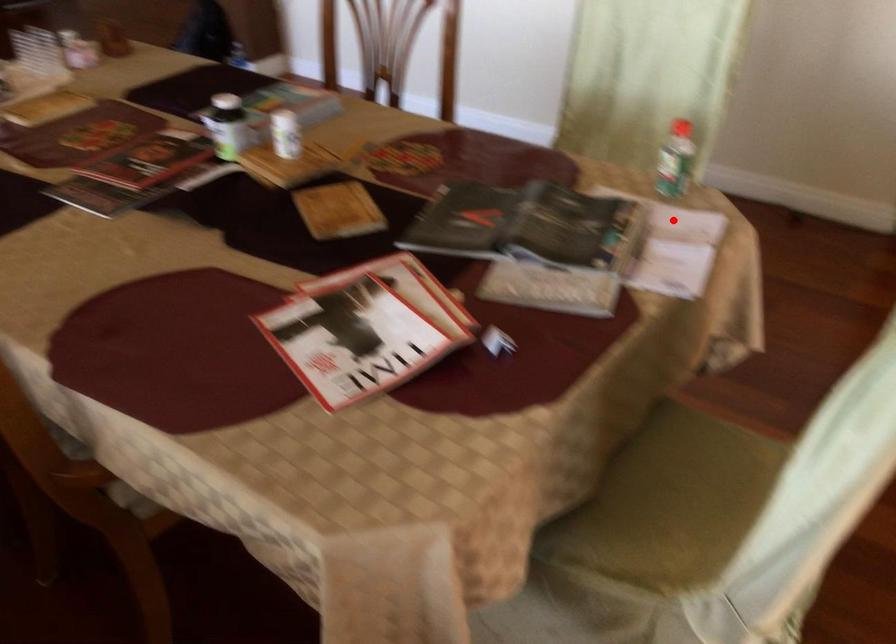
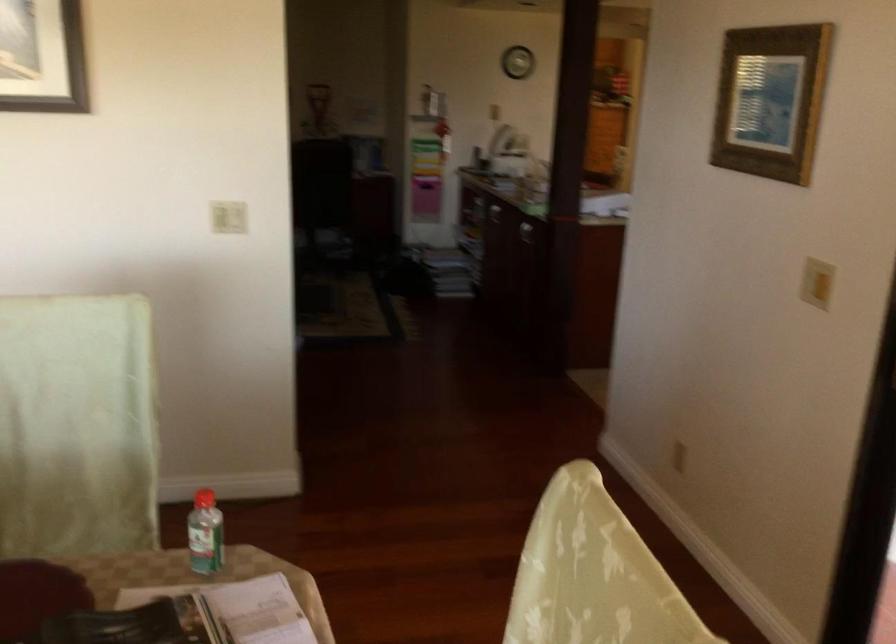
In the second image, find the point that corresponds to the highlighted location in the first image.

(238, 609)